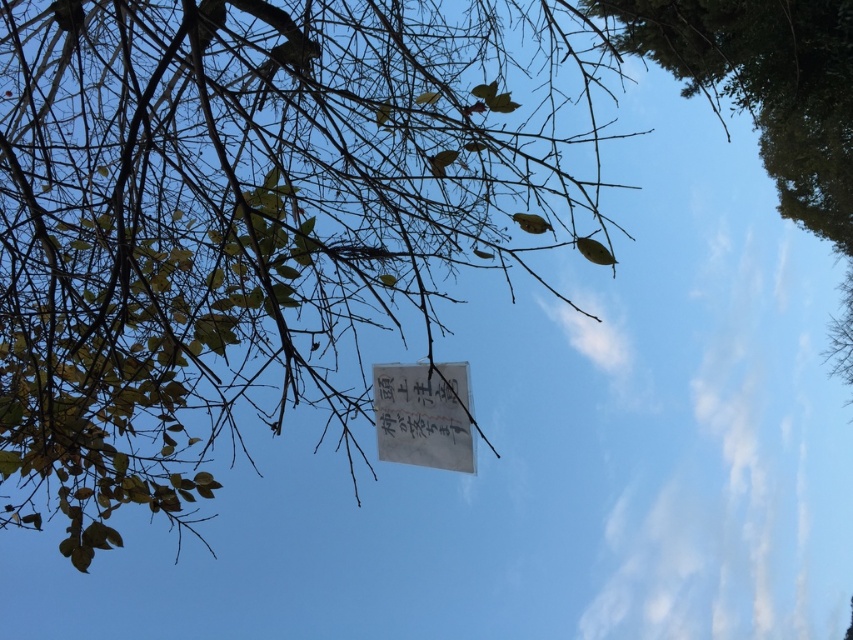
Question: Is green leafy tree at upper right positioned in front of white paper sign at center?

Choices:
 (A) no
 (B) yes

Answer: (A)

Question: Which object appears closest to the camera in this image?

Choices:
 (A) white paper sign at center
 (B) green leafy tree at upper right

Answer: (A)

Question: Which object is positioned farthest from the white paper at center?

Choices:
 (A) green leafy tree at upper right
 (B) white paper sign at center

Answer: (A)

Question: Where is white paper at center located in relation to green leafy tree at upper right in the image?

Choices:
 (A) below
 (B) above

Answer: (A)

Question: Among these objects, which one is farthest from the camera?

Choices:
 (A) white paper at center
 (B) green leafy tree at upper right
 (C) white paper sign at center

Answer: (B)

Question: Can you confirm if white paper at center is positioned above white paper sign at center?

Choices:
 (A) yes
 (B) no

Answer: (A)